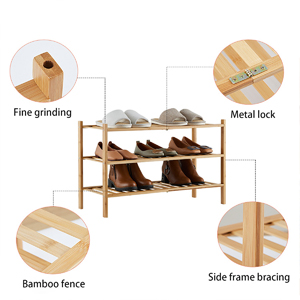
Where is `shoes on bottom shelf`? shoes on bottom shelf is located at coordinates (123, 177), (137, 175), (172, 171), (188, 171).